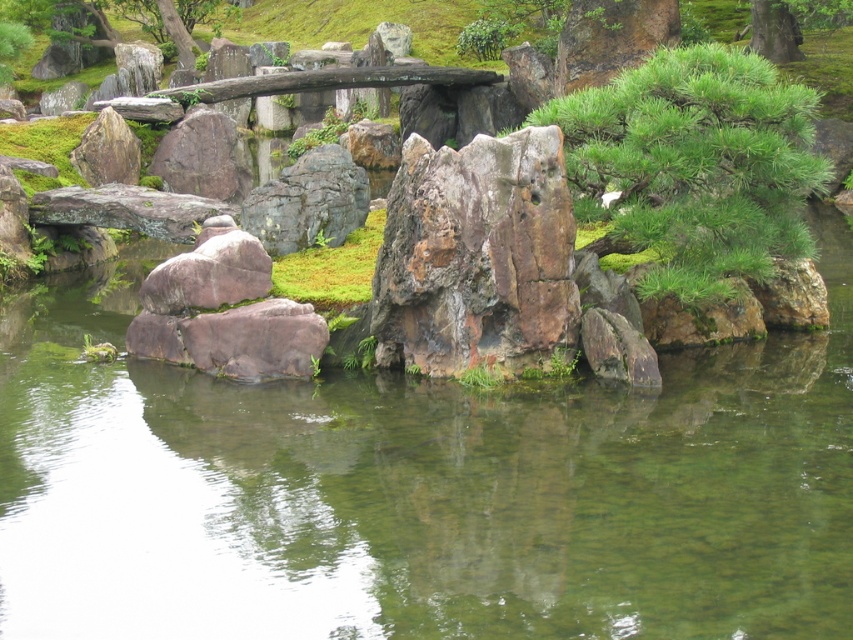
You are standing in a Japanese garden and see two points marked in the scene. The first point is at coordinates point (502, 298) and the second is at point (310, 163). Which of these points is closer to you?

Point (502, 298) is closer to the viewer than point (310, 163).

Looking at this image, you are standing at the center of the Japanese garden and want to take a photo of the green textured pine tree at center right. Based on the coordinates provided, in which direction should you move to position yourself directly in front of it?

The green textured pine tree at center right is located at coordinates 0.259 on the x axis and 0.815 on the y axis. Since you are at the center, moving towards the lower left direction would position you directly in front of it.

You are standing in the Japanese garden and want to take a photo of the point at coordinates (593, 106). If your camera has a maximum focus range of 15 meters, will it be able to focus on that point?

The point at coordinates (593, 106) is 13.77 meters from the camera, which is within the maximum focus range of 15 meters. Therefore, the camera can focus on that point.